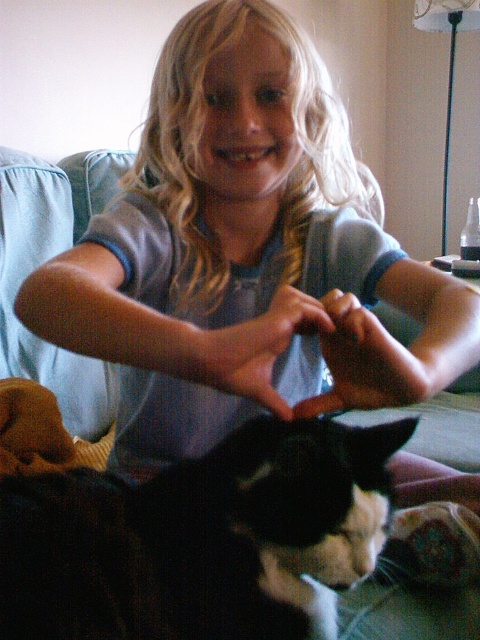
Does matte blue shirt at center appear on the left side of black fur cat at lower left?

Incorrect, matte blue shirt at center is not on the left side of black fur cat at lower left.

From the picture: Can you confirm if matte blue shirt at center is taller than black fur cat at lower left?

Yes.

The image size is (480, 640). What do you see at coordinates (245, 253) in the screenshot?
I see `matte blue shirt at center` at bounding box center [245, 253].

Locate an element on the screen. Image resolution: width=480 pixels, height=640 pixels. matte blue shirt at center is located at coordinates (245, 253).